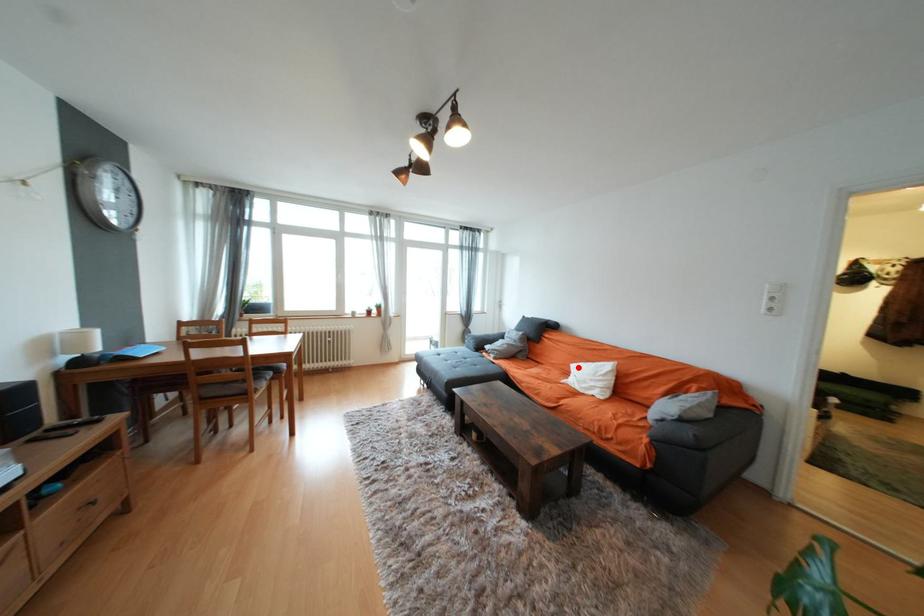
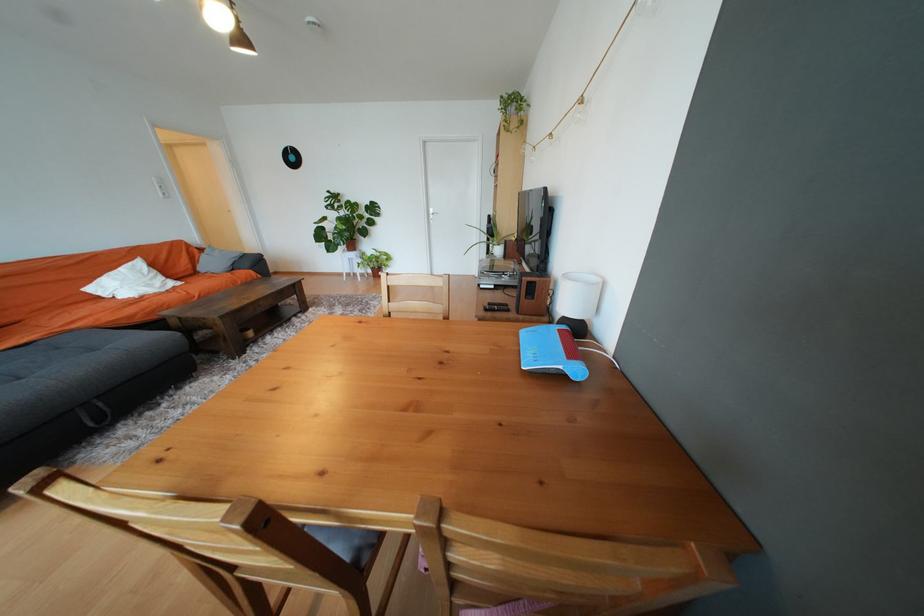
Question: I am providing you with two images of the same scene from different viewpoints. A red point is shown in image1. For the corresponding object point in image2, is it positioned nearer or farther from the camera?

Choices:
 (A) Nearer
 (B) Farther

Answer: (B)